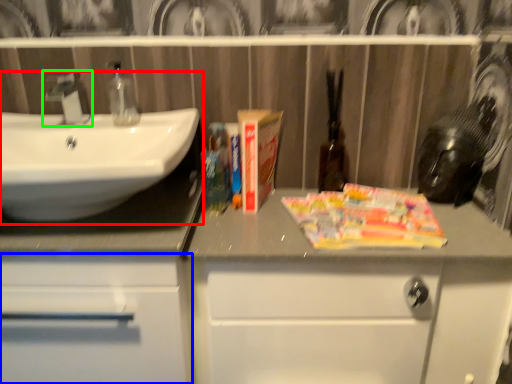
Question: Based on their relative distances, which object is nearer to sink (highlighted by a red box)? Choose from bathroom cabinet (highlighted by a blue box) and tap (highlighted by a green box).

Choices:
 (A) bathroom cabinet
 (B) tap

Answer: (B)